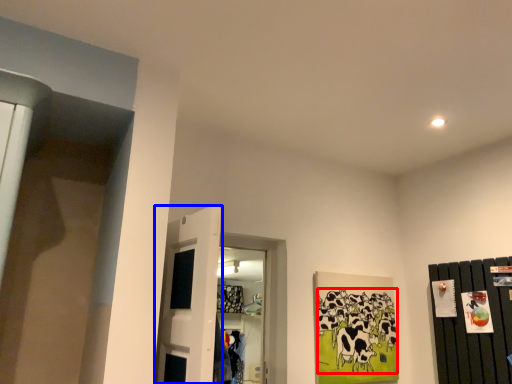
Question: Which object is closer to the camera taking this photo, animal (highlighted by a red box) or door (highlighted by a blue box)?

Choices:
 (A) animal
 (B) door

Answer: (B)